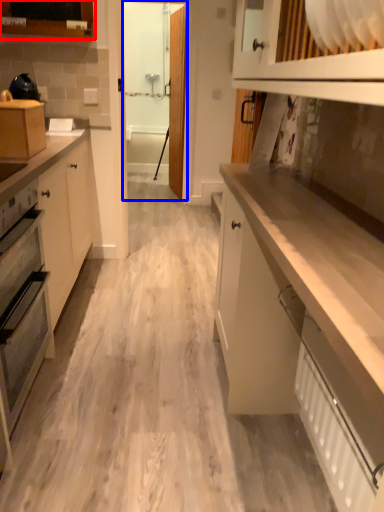
Question: Which of the following is the closest to the observer, cabinetry (highlighted by a red box) or glass door (highlighted by a blue box)?

Choices:
 (A) cabinetry
 (B) glass door

Answer: (A)